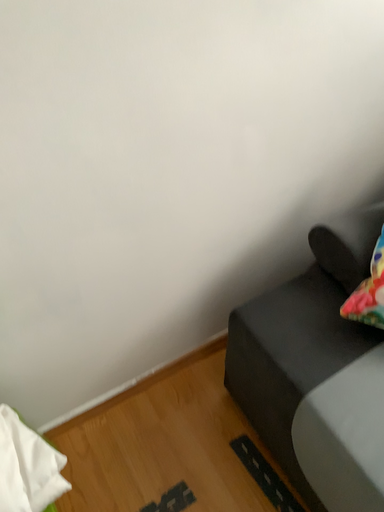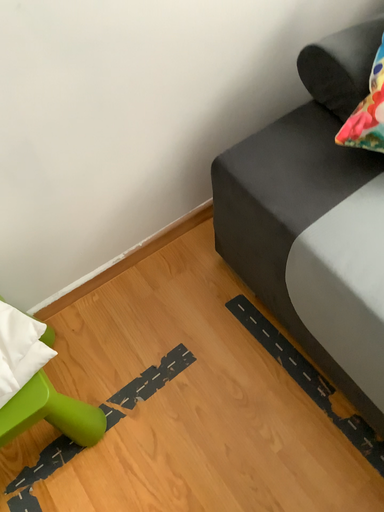
Question: How did the camera likely rotate when shooting the video?

Choices:
 (A) rotated downward
 (B) rotated upward

Answer: (A)